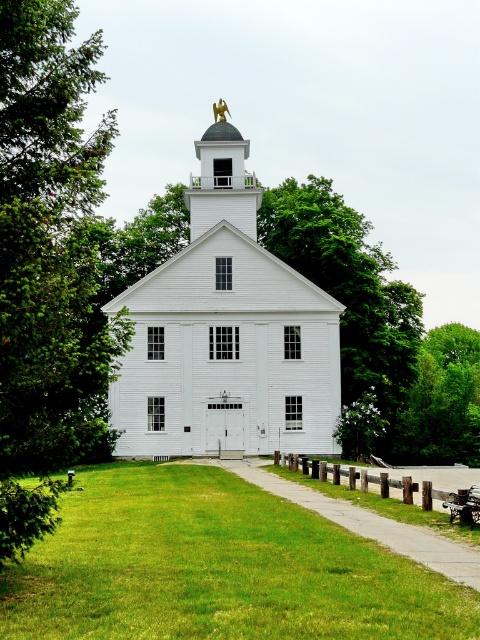
Is point (210, 531) more distant than point (210, 131)?

No, (210, 531) is in front of (210, 131).

Who is shorter, green grass at center or gold plated eagle at upper center?

green grass at center

Between point (325, 588) and point (211, 166), which one is positioned behind?

The point (211, 166) is behind.

Where is `green grass at center`? green grass at center is located at coordinates (216, 568).

This screenshot has height=640, width=480. What do you see at coordinates (365, 522) in the screenshot?
I see `gravel path at center` at bounding box center [365, 522].

Who is more forward, (387,545) or (452,513)?

Point (387,545)

Locate an element on the screen. This screenshot has height=640, width=480. gravel path at center is located at coordinates (365, 522).

Find the location of a particular element. The width and height of the screenshot is (480, 640). green leafy tree at left is located at coordinates (x=48, y=264).

Between green leafy tree at left and brown wooden park bench at lower right, which one is positioned lower?

brown wooden park bench at lower right is lower down.

The image size is (480, 640). Describe the element at coordinates (48, 264) in the screenshot. I see `green leafy tree at left` at that location.

Where is `green leafy tree at left`? green leafy tree at left is located at coordinates (48, 264).